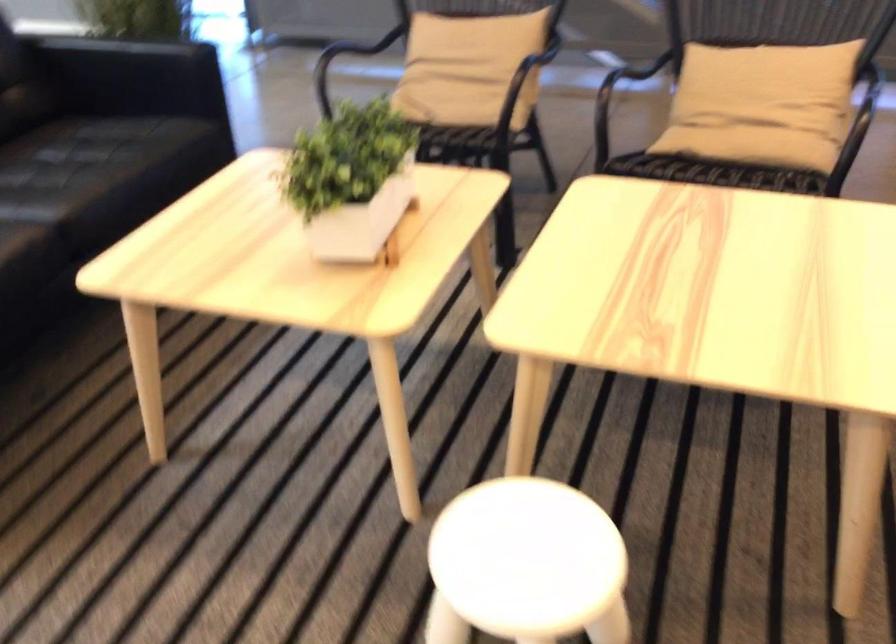
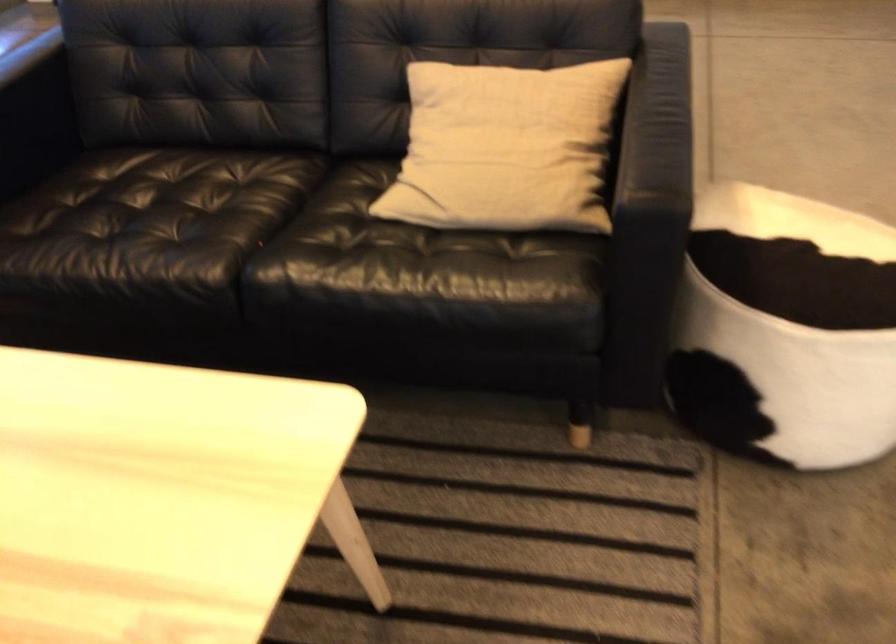
The images are taken continuously from a first-person perspective. In which direction is your viewpoint rotating?

The camera rotated toward right-down.